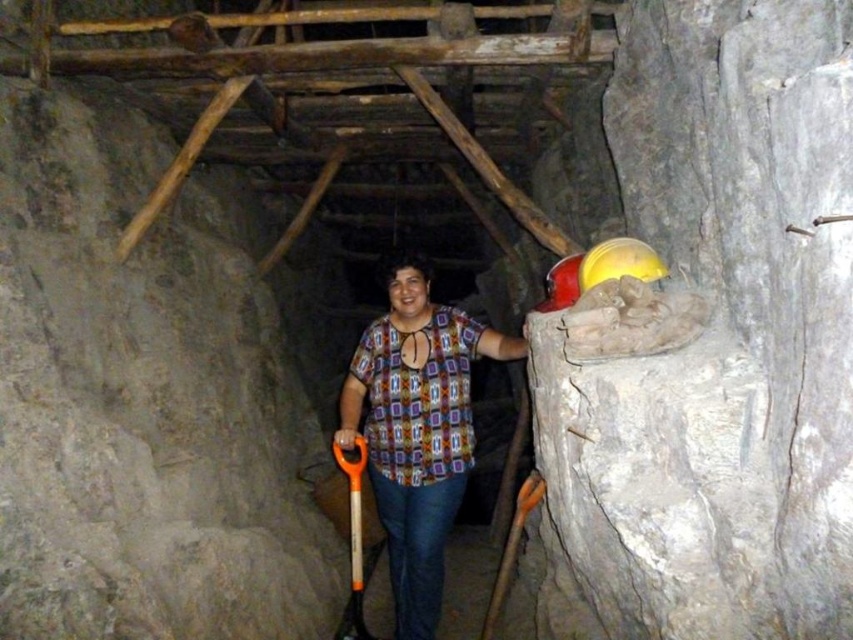
You are an archaeologist working in this rustic, stone walled space. You need to retrieve the orange plastic shovel at lower center but there is an orange plastic shovel at center blocking your path. Can you reach the shovel below without moving the one above?

The orange plastic shovel at center is located above the orange plastic shovel at lower center, so you can reach the shovel below without moving the one above as they are separate objects at different positions.